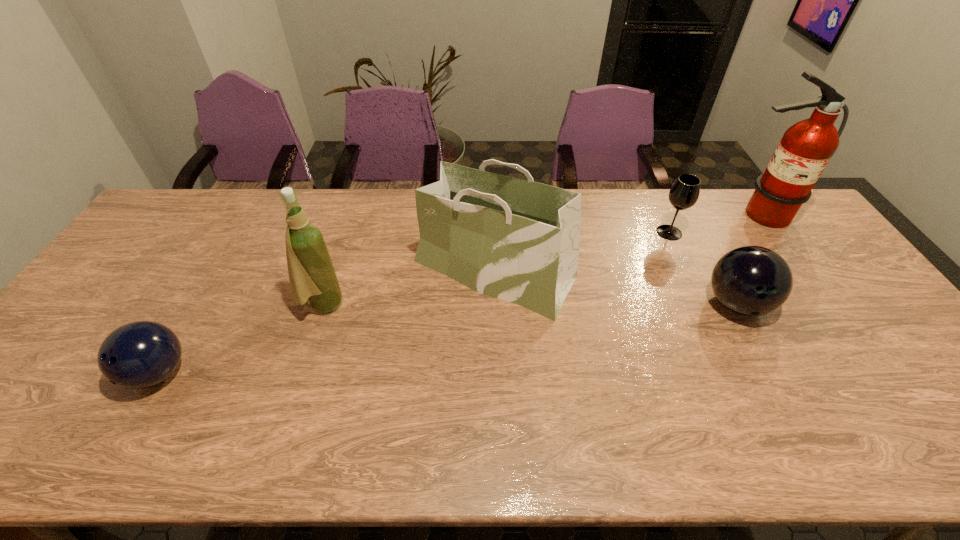
This screenshot has width=960, height=540. Identify the location of unoccupied area between the wineglass and the leftmost object. (414, 303).

Where is `vacant point located between the wine bottle and the grocery bag`? The height and width of the screenshot is (540, 960). vacant point located between the wine bottle and the grocery bag is located at coordinates (408, 288).

The image size is (960, 540). Find the location of `unoccupied area between the wineglass and the fourth object from right to left`. unoccupied area between the wineglass and the fourth object from right to left is located at coordinates (582, 252).

This screenshot has width=960, height=540. In order to click on unoccupied position between the tallest object and the nearest object in this screenshot , I will do `click(458, 294)`.

You are a GUI agent. You are given a task and a screenshot of the screen. Output one action in this format:
    pyautogui.click(x=<x>, y=<y>)
    Task: Click on the closest object relative to the wineglass
    The width and height of the screenshot is (960, 540).
    Given the screenshot: What is the action you would take?
    pyautogui.click(x=805, y=149)

Identify which object is the second closest to the fire extinguisher. Please provide its 2D coordinates. Your answer should be formatted as a tuple, i.e. [(x, y)], where the tuple contains the x and y coordinates of a point satisfying the conditions above.

[(750, 280)]

Where is `vacant region that satisfies the following two spatial constraints: 1. on the front-facing side of the second object from left to right; 2. on the surface of the shortest object near the finger holes`? This screenshot has height=540, width=960. vacant region that satisfies the following two spatial constraints: 1. on the front-facing side of the second object from left to right; 2. on the surface of the shortest object near the finger holes is located at coordinates (300, 373).